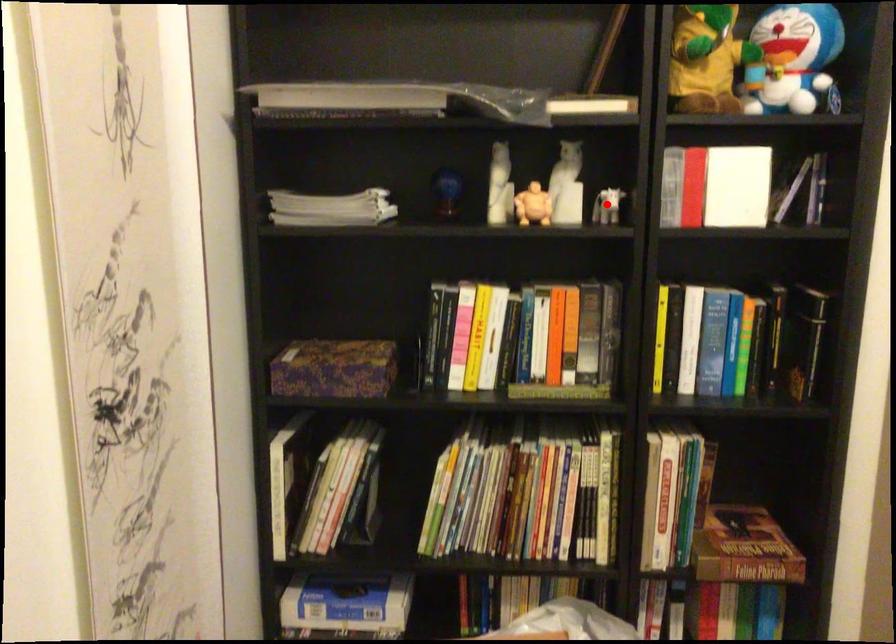
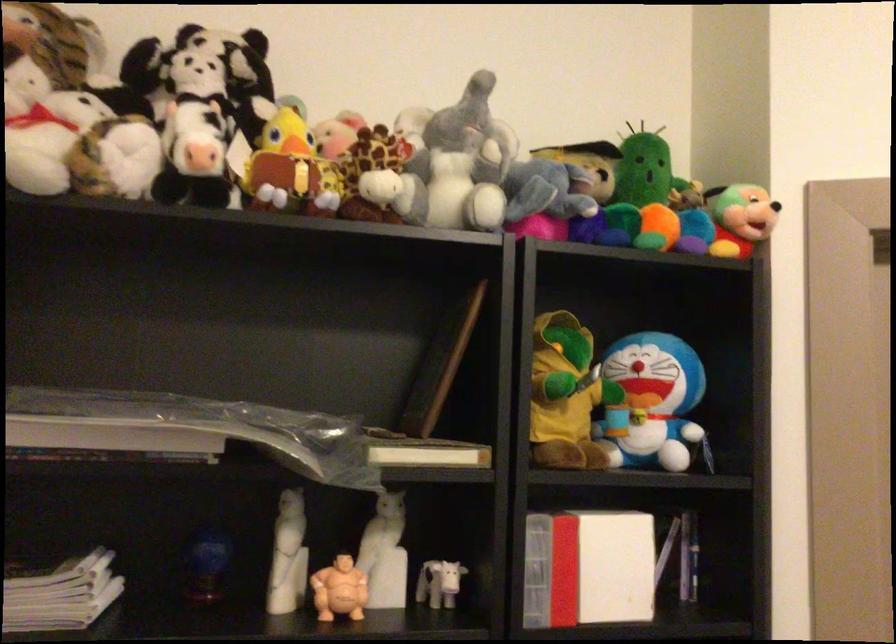
Question: A red point is marked in image1. In image2, is the corresponding 3D point closer to the camera or farther? Reply with the corresponding letter.

Choices:
 (A) The corresponding 3D point is closer.
 (B) The corresponding 3D point is farther.

Answer: (A)